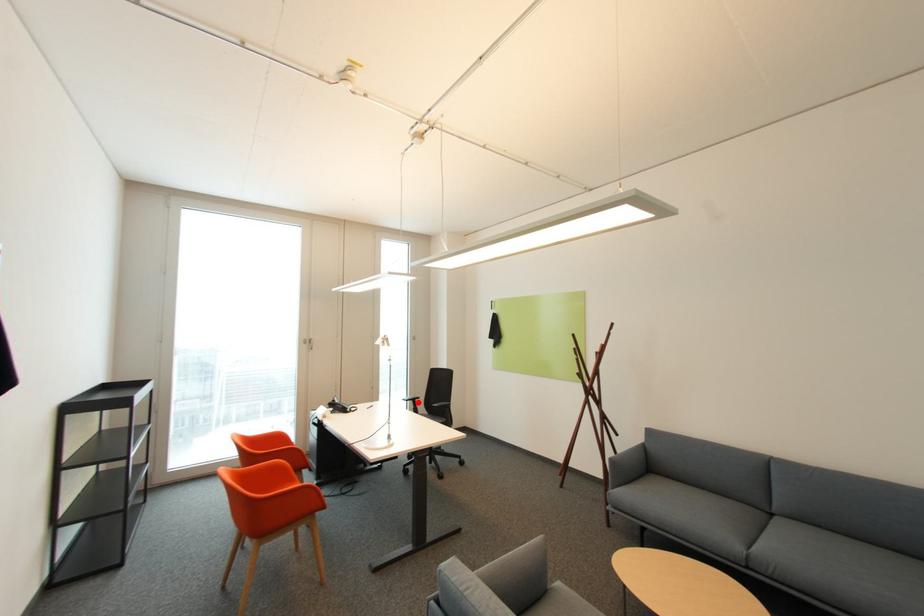
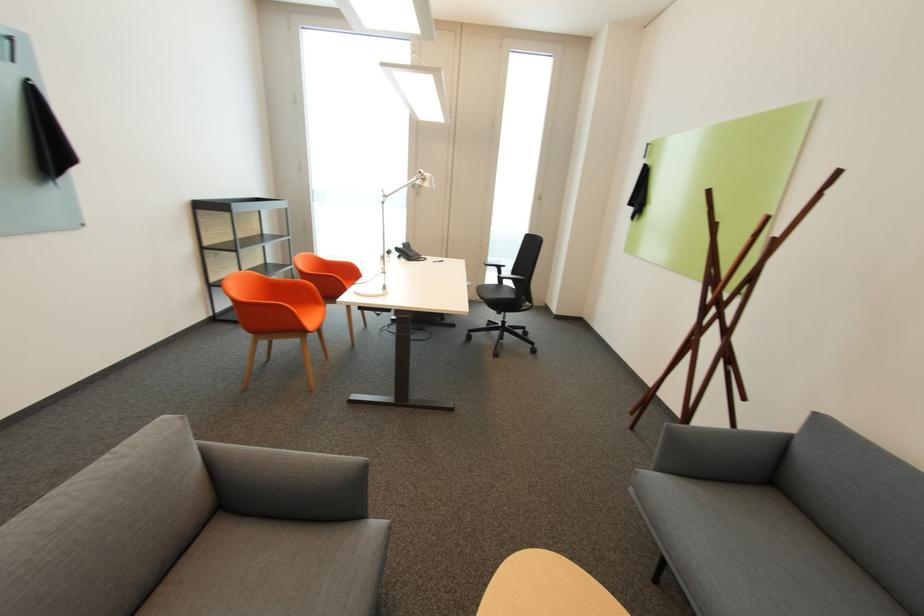
Question: A red point is marked in image1. In image2, is the corresponding 3D point closer to the camera or farther? Reply with the corresponding letter.

Choices:
 (A) The corresponding 3D point is closer.
 (B) The corresponding 3D point is farther.

Answer: (A)